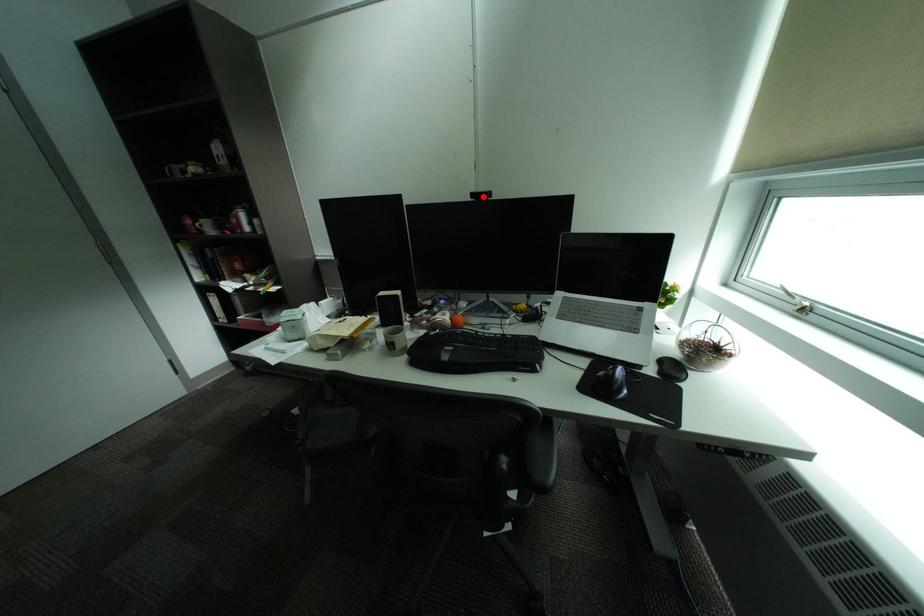
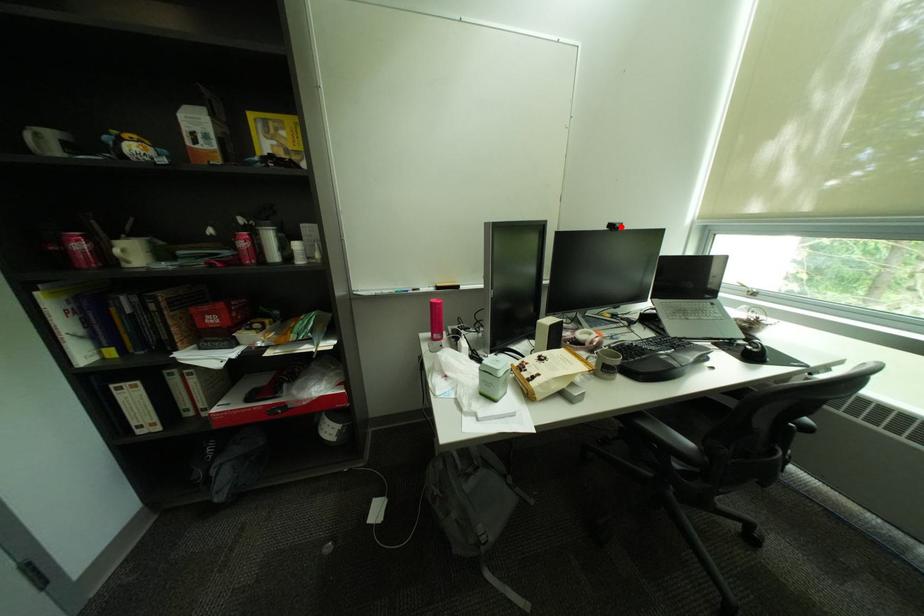
I am providing you with two images of the same scene from different viewpoints. A red point is marked on the first image and another point is marked on the second image. Does the point marked in image1 correspond to the same location as the one in image2?

Yes